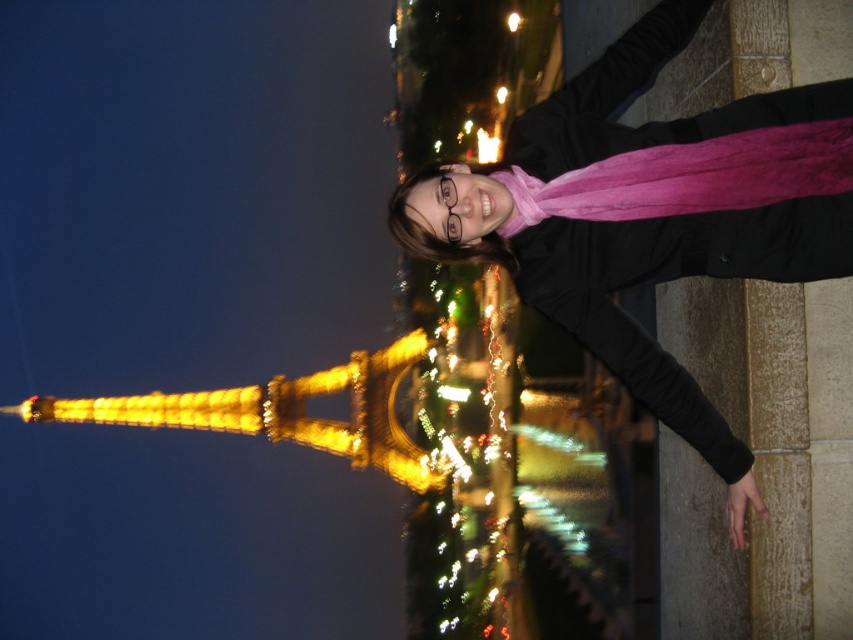
You are a tourist in Paris and see the golden illuminated eiffel tower at center and the golden illuminated tower at left. Which one is narrower?

The golden illuminated eiffel tower at center is thinner than the golden illuminated tower at left.

You are a tourist standing in front of the golden illuminated eiffel tower at center and the golden illuminated tower at left. Which one would you need to walk towards first to get closer to the one that is nearer to you?

The golden illuminated eiffel tower at center is already closer to you than the golden illuminated tower at left, so you don not need to walk towards either to get closer to the nearer one.